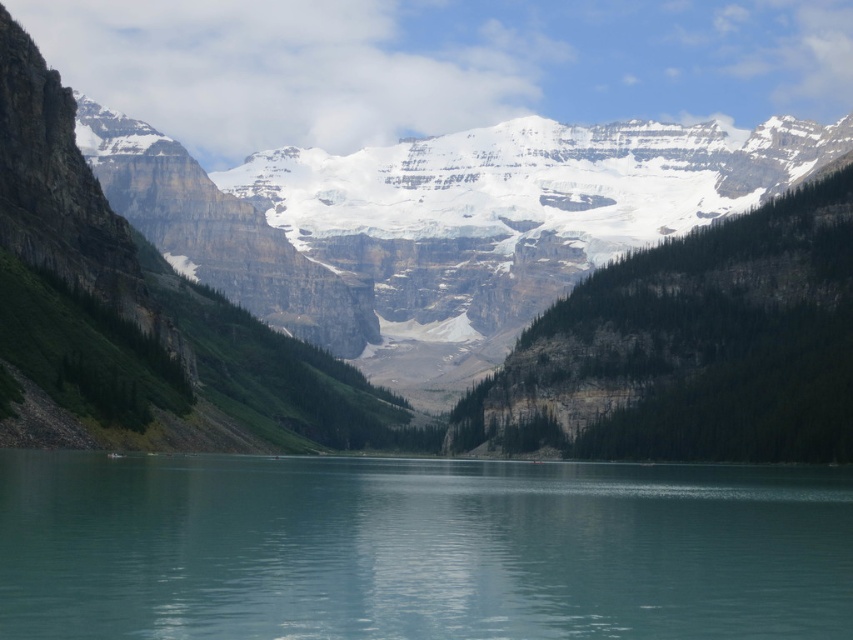
You are standing at the edge of the lake in the serene mountainous landscape. You see two points marked in the image. Which point, point (648, 451) or point (790, 577), is closer to you?

Answer: Point (648, 451) is further to the camera than point (790, 577), so the closer point to you is point (790, 577).

You are standing at the point marked by point (492, 273) in the image. Which direction should you face to see the rocky mountain range at center?

You should face towards the center to see the rocky mountain range at center, as the point (492, 273) represents the location of the rocky mountain range at center.

Looking at this image, you are standing at the edge of the lake and looking towards the center of the image. Which object is positioned higher in your field of view, the rocky mountain range at center or the turquoise glassy water at center?

The rocky mountain range at center is positioned above the turquoise glassy water at center, so it is higher in your field of view.